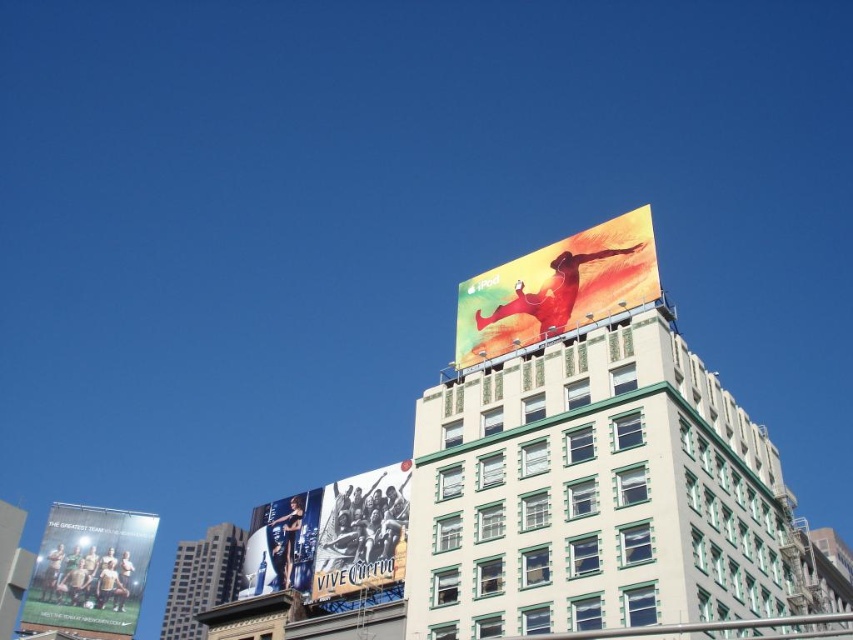
Which is behind, point (497, 314) or point (357, 540)?

The point (497, 314) is more distant.

Can you confirm if matte yellow poster at upper right is positioned to the left of metallic silver sign at center?

In fact, matte yellow poster at upper right is to the right of metallic silver sign at center.

Is point (646, 289) in front of point (393, 570)?

Yes.

You are a GUI agent. You are given a task and a screenshot of the screen. Output one action in this format:
    pyautogui.click(x=<x>, y=<y>)
    Task: Click on the matte yellow poster at upper right
    The height and width of the screenshot is (640, 853).
    Given the screenshot: What is the action you would take?
    556,289

Can you confirm if matte yellow poster at upper right is taller than matte white soccer team at lower left?

Yes, matte yellow poster at upper right is taller than matte white soccer team at lower left.

Does matte yellow poster at upper right appear over matte white soccer team at lower left?

Yes, matte yellow poster at upper right is above matte white soccer team at lower left.

The width and height of the screenshot is (853, 640). In order to click on matte yellow poster at upper right in this screenshot , I will do `click(556, 289)`.

Is matte yellow poster at upper right above dark gray concrete building at center?

Indeed, matte yellow poster at upper right is positioned over dark gray concrete building at center.

Who is positioned more to the left, matte yellow poster at upper right or dark gray concrete building at center?

Positioned to the left is dark gray concrete building at center.

Does point (616, 268) lie behind point (194, 602)?

No, it is in front of (194, 602).

The image size is (853, 640). What are the coordinates of `matte yellow poster at upper right` in the screenshot? It's located at (556, 289).